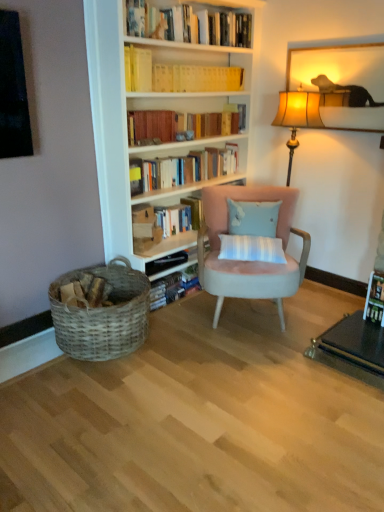
In order to click on free point in front of suede pink armchair at center in this screenshot , I will do `click(238, 366)`.